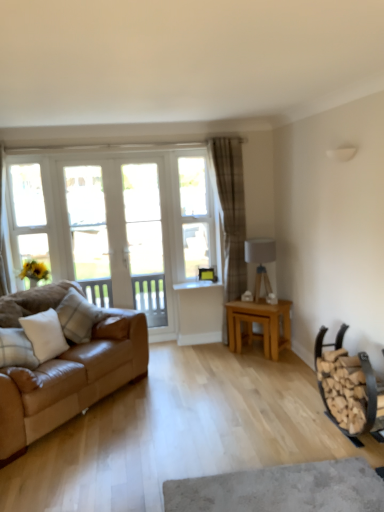
You are a GUI agent. You are given a task and a screenshot of the screen. Output one action in this format:
    pyautogui.click(x=<x>, y=<y>)
    Task: Click on the free location to the left of light brown wooden table at center
    
    Given the screenshot: What is the action you would take?
    pyautogui.click(x=222, y=355)